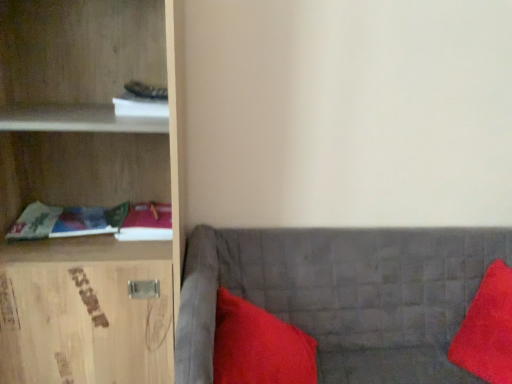
Find the location of a particular element. This screenshot has height=384, width=512. free space above white paper at upper left, which is the 1th book in top-to-bottom order (from a real-world perspective) is located at coordinates (147, 91).